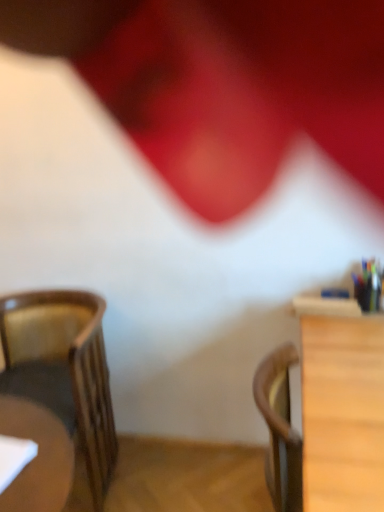
Question: Does wooden chair at left appear on the right side of wooden table at right?

Choices:
 (A) no
 (B) yes

Answer: (A)

Question: From a real-world perspective, does wooden chair at left sit lower than wooden table at right?

Choices:
 (A) no
 (B) yes

Answer: (B)

Question: Does wooden chair at left turn towards wooden table at right?

Choices:
 (A) no
 (B) yes

Answer: (A)

Question: Considering the relative sizes of wooden chair at left and wooden table at right in the image provided, is wooden chair at left smaller than wooden table at right?

Choices:
 (A) no
 (B) yes

Answer: (A)

Question: Can you confirm if wooden chair at left is shorter than wooden table at right?

Choices:
 (A) no
 (B) yes

Answer: (A)

Question: Is wooden table at right at the back of wooden chair at left?

Choices:
 (A) yes
 (B) no

Answer: (B)

Question: Is wooden table at right further to the viewer compared to wooden chair at left?

Choices:
 (A) yes
 (B) no

Answer: (B)

Question: Can you confirm if wooden table at right is positioned to the right of wooden chair at left?

Choices:
 (A) yes
 (B) no

Answer: (A)

Question: From the image's perspective, does wooden table at right appear lower than wooden chair at left?

Choices:
 (A) no
 (B) yes

Answer: (B)

Question: Considering the relative sizes of wooden table at right and wooden chair at left in the image provided, is wooden table at right wider than wooden chair at left?

Choices:
 (A) no
 (B) yes

Answer: (A)

Question: Would you say wooden chair at left is part of wooden table at right's contents?

Choices:
 (A) yes
 (B) no

Answer: (B)

Question: Considering the relative sizes of wooden table at right and wooden chair at left in the image provided, is wooden table at right taller than wooden chair at left?

Choices:
 (A) yes
 (B) no

Answer: (B)

Question: Is wooden table at right bigger or smaller than wooden chair at left?

Choices:
 (A) big
 (B) small

Answer: (B)